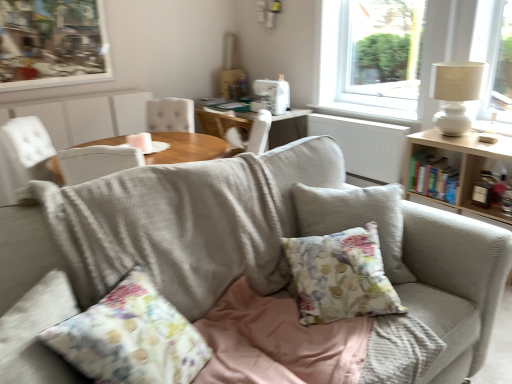
Identify the location of textured fabric couch at center. (161, 254).

This screenshot has height=384, width=512. In order to click on white glass window at upper right in this screenshot , I will do `click(421, 61)`.

Describe the element at coordinates (456, 94) in the screenshot. Image resolution: width=512 pixels, height=384 pixels. I see `white ceramic table lamp at upper right` at that location.

You are a GUI agent. You are given a task and a screenshot of the screen. Output one action in this format:
    pyautogui.click(x=<x>, y=<y>)
    Task: Click on the white fabric chair at center
    The width and height of the screenshot is (512, 384).
    Given the screenshot: What is the action you would take?
    pyautogui.click(x=238, y=129)

The image size is (512, 384). Describe the element at coordinates (238, 129) in the screenshot. I see `white fabric chair at center` at that location.

Measure the distance between white painted wood at upper right and camera.

The distance of white painted wood at upper right from camera is 3.20 meters.

The image size is (512, 384). What do you see at coordinates (368, 113) in the screenshot?
I see `white painted wood at upper right` at bounding box center [368, 113].

Locate an element on the screen. The height and width of the screenshot is (384, 512). wooden table at right is located at coordinates (462, 162).

Is wooden table at right not close to white fabric chair at center?

That's right, there is a large distance between wooden table at right and white fabric chair at center.

Considering the positions of point (457, 148) and point (240, 136), is point (457, 148) closer or farther from the camera than point (240, 136)?

Point (457, 148) is positioned closer to the camera compared to point (240, 136).

How different are the orientations of wooden table at right and white fabric chair at center in degrees?

wooden table at right and white fabric chair at center are facing 176 degrees away from each other.

From a real-world perspective, is white fabric chair at center positioned under white painted wood at upper right based on gravity?

Yes.

Considering the relative sizes of white fabric chair at center and white painted wood at upper right in the image provided, is white fabric chair at center smaller than white painted wood at upper right?

Incorrect, white fabric chair at center is not smaller in size than white painted wood at upper right.

From their relative heights in the image, would you say white fabric chair at center is taller or shorter than white painted wood at upper right?

Considering their sizes, white fabric chair at center has more height than white painted wood at upper right.

Is white fabric chair at center facing towards white painted wood at upper right?

No, white fabric chair at center is not facing towards white painted wood at upper right.

Considering the sizes of white glass window at upper right and textured fabric couch at center in the image, is white glass window at upper right taller or shorter than textured fabric couch at center?

white glass window at upper right is taller than textured fabric couch at center.

Is white glass window at upper right next to textured fabric couch at center?

No, white glass window at upper right is not making contact with textured fabric couch at center.

Does white glass window at upper right turn towards textured fabric couch at center?

Yes, white glass window at upper right faces towards textured fabric couch at center.

Is white painted wood at upper right further to camera compared to floral fabric cushion at center?

Yes, white painted wood at upper right is behind floral fabric cushion at center.

Considering the sizes of white painted wood at upper right and floral fabric cushion at center in the image, is white painted wood at upper right wider or thinner than floral fabric cushion at center?

white painted wood at upper right is thinner than floral fabric cushion at center.

From a real-world perspective, who is located higher, white painted wood at upper right or floral fabric cushion at center?

white painted wood at upper right.

Considering the relative sizes of white painted wood at upper right and floral fabric cushion at center in the image provided, is white painted wood at upper right bigger than floral fabric cushion at center?

Actually, white painted wood at upper right might be smaller than floral fabric cushion at center.

What's the angular difference between white ceramic table lamp at upper right and white glass window at upper right's facing directions?

The facing directions of white ceramic table lamp at upper right and white glass window at upper right are 1.42 degrees apart.

Who is taller, white ceramic table lamp at upper right or white glass window at upper right?

With more height is white glass window at upper right.

Does white ceramic table lamp at upper right turn towards white glass window at upper right?

No, white ceramic table lamp at upper right is not aimed at white glass window at upper right.

Looking at the image, does white ceramic table lamp at upper right seem bigger or smaller compared to white glass window at upper right?

white ceramic table lamp at upper right is smaller than white glass window at upper right.

Relative to floral fabric cushion at center, is white glass window at upper right in front or behind?

Visually, white glass window at upper right is located behind floral fabric cushion at center.

Is white glass window at upper right taller than floral fabric cushion at center?

Indeed, white glass window at upper right has a greater height compared to floral fabric cushion at center.

Between white glass window at upper right and floral fabric cushion at center, which one has smaller size?

With smaller size is floral fabric cushion at center.

Find the location of a particular element. This screenshot has height=384, width=512. window positioned vertically above the floral fabric cushion at center (from a real-world perspective) is located at coordinates (421, 61).

In the image, is white glass window at upper right positioned in front of or behind white textured radiator at center?

A: Visually, white glass window at upper right is located in front of white textured radiator at center.

Which point is more forward, (x=468, y=53) or (x=385, y=156)?

The point (x=468, y=53) is in front.

Does white glass window at upper right have a smaller size compared to white textured radiator at center?

No, white glass window at upper right is not smaller than white textured radiator at center.

Is white glass window at upper right turned away from white textured radiator at center?

No, white glass window at upper right is not facing the opposite direction of white textured radiator at center.

Where is `chair on the left of wooden table at right`? chair on the left of wooden table at right is located at coordinates (238, 129).

The height and width of the screenshot is (384, 512). In order to click on window sill lying above the white fabric chair at center (from the image's perspective) in this screenshot , I will do `click(368, 113)`.

Based on the photo, based on their spatial positions, is white ceramic table lamp at upper right or white painted wood at upper right closer to wooden table at right?

white ceramic table lamp at upper right is closer to wooden table at right.

Which object lies further to the anchor point white ceramic table lamp at upper right, white textured radiator at center or floral fabric cushion at center?

floral fabric cushion at center is positioned further to the anchor white ceramic table lamp at upper right.

When comparing their distances from wooden table at right, does white ceramic table lamp at upper right or textured fabric couch at center seem further?

The object further to wooden table at right is textured fabric couch at center.

Estimate the real-world distances between objects in this image. Which object is closer to wooden table at right, floral fabric cushion at center or textured fabric couch at center?

Based on the image, floral fabric cushion at center appears to be nearer to wooden table at right.

Considering their positions, is white fabric chair at center positioned closer to white glass window at upper right than white textured radiator at center?

Based on the image, white textured radiator at center appears to be nearer to white glass window at upper right.

Looking at the image, which one is located closer to wooden table at right, wooden picture frame at upper left or white ceramic table lamp at upper right?

white ceramic table lamp at upper right.

Looking at the image, which one is located further to floral fabric cushion at center, white ceramic table lamp at upper right or white glass window at upper right?

white glass window at upper right is further to floral fabric cushion at center.

When comparing their distances from wooden table at right, does wooden picture frame at upper left or textured fabric couch at center seem further?

The object further to wooden table at right is wooden picture frame at upper left.

Where is `pillow between wooden picture frame at upper left and white textured radiator at center from left to right`? Image resolution: width=512 pixels, height=384 pixels. pillow between wooden picture frame at upper left and white textured radiator at center from left to right is located at coordinates (341, 276).

This screenshot has height=384, width=512. I want to click on window sill between wooden picture frame at upper left and white glass window at upper right from left to right, so coord(368,113).

You are a GUI agent. You are given a task and a screenshot of the screen. Output one action in this format:
    pyautogui.click(x=<x>, y=<y>)
    Task: Click on the window between textured fabric couch at center and wooden picture frame at upper left in the front-back direction
    
    Given the screenshot: What is the action you would take?
    pyautogui.click(x=421, y=61)

I want to click on pillow situated between wooden picture frame at upper left and wooden table at right from left to right, so click(x=341, y=276).